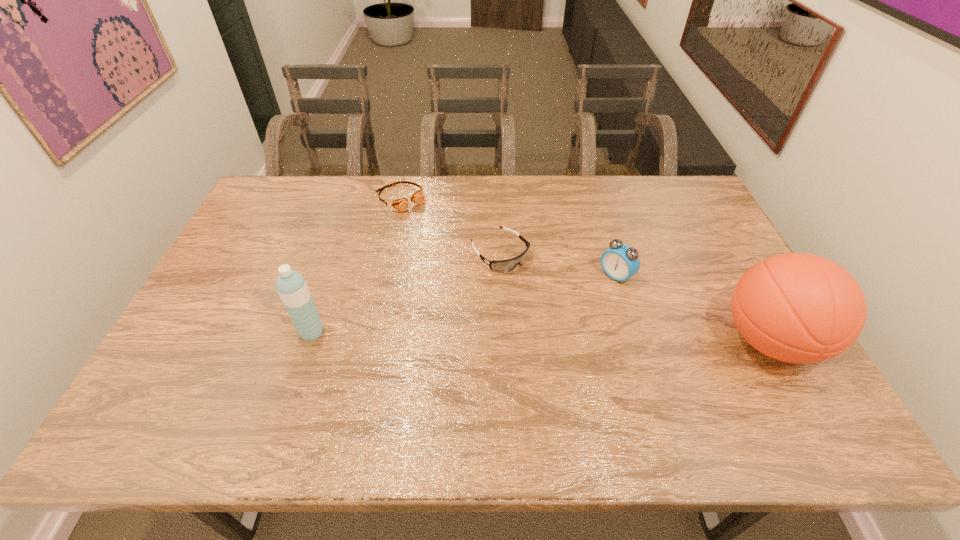
Image resolution: width=960 pixels, height=540 pixels. In order to click on water bottle in this screenshot , I will do `click(291, 286)`.

Locate an element on the screen. the rightmost object is located at coordinates (802, 308).

Find the location of a particular element. Image resolution: width=960 pixels, height=540 pixels. the nearer goggles is located at coordinates (508, 265).

In order to click on the right goggles in this screenshot , I will do `click(508, 265)`.

Find the location of a particular element. The image size is (960, 540). the third tallest object is located at coordinates (620, 262).

Where is `alarm clock`? Image resolution: width=960 pixels, height=540 pixels. alarm clock is located at coordinates (620, 262).

Find the location of a particular element. This screenshot has width=960, height=540. the farthest object is located at coordinates (402, 204).

The width and height of the screenshot is (960, 540). Identify the location of the farther goggles. coord(402,204).

I want to click on vacant area situated 0.130m on the left of the water bottle, so coord(250,332).

I want to click on free space located on the back of the basketball, so click(x=738, y=284).